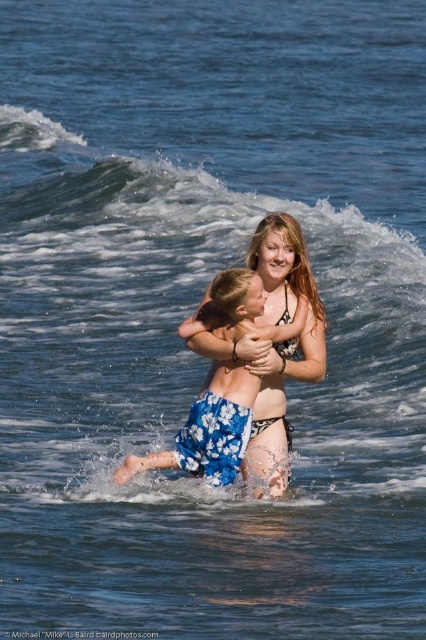
Does white foamy wave at upper center have a greater height compared to blue floral shorts at center?

Yes.

Does white foamy wave at upper center appear under blue floral shorts at center?

Actually, white foamy wave at upper center is above blue floral shorts at center.

Between point (408, 291) and point (216, 406), which one is positioned behind?

Positioned behind is point (408, 291).

At what (x,y) coordinates should I click in order to perform the action: click on white foamy wave at upper center. Please return your answer as a coordinate pair (x, y). The width and height of the screenshot is (426, 640). Looking at the image, I should click on (169, 230).